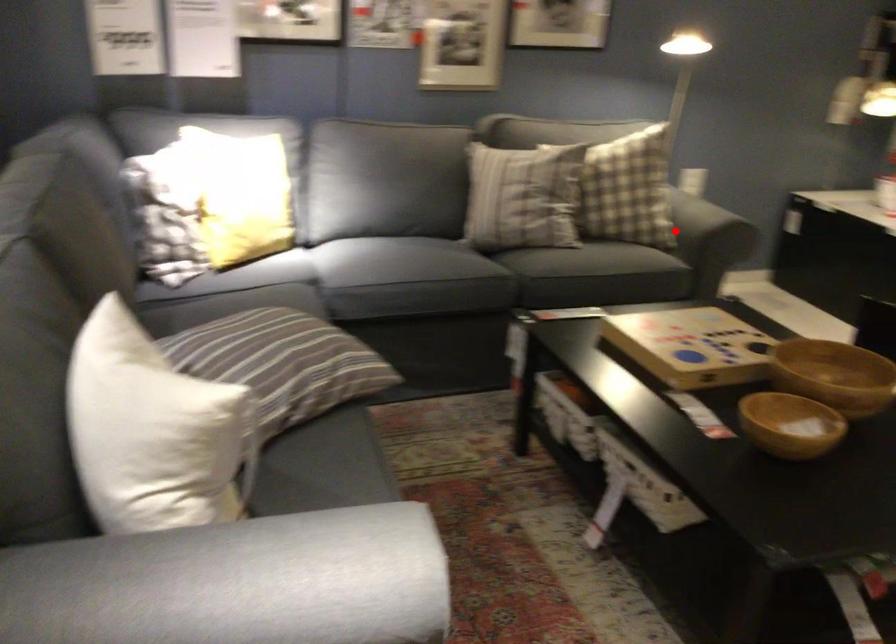
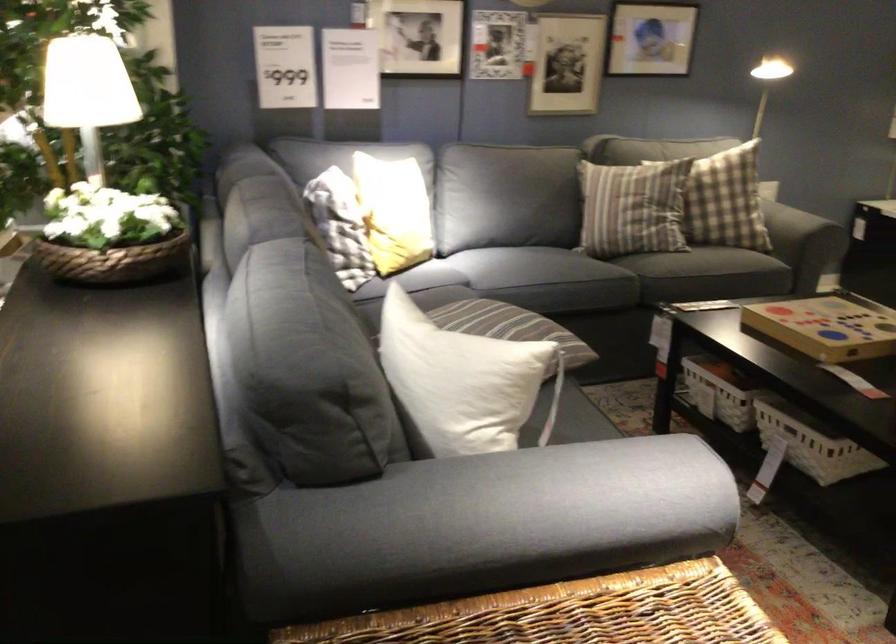
The point at the highlighted location is marked in the first image. Where is the corresponding point in the second image?

(798, 223)